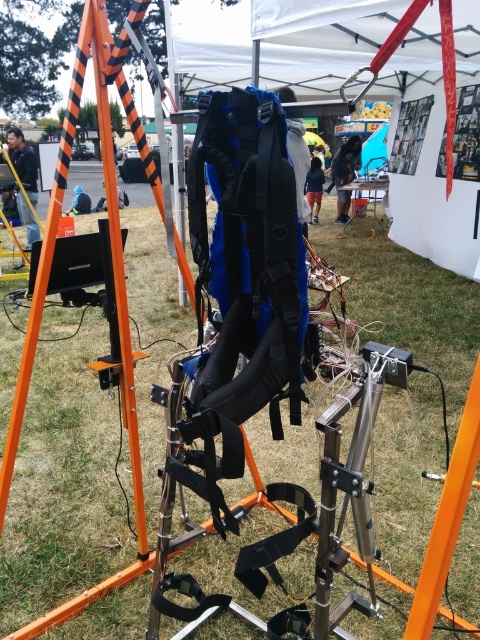
Based on the photo, you are at a tech fair and see the orange metallic ladder at center and the dark blue fabric jacket at center. Which object takes up more space in the image?

The orange metallic ladder at center is bigger than dark blue fabric jacket at center, so it takes up more space in the image.

You are standing in the middle of the outdoor area and see the green grass at center and the orange metallic ladder at center. Which object is closer to the ground?

The green grass at center is positioned under the orange metallic ladder at center, so the green grass at center is closer to the ground.

You are standing at the point marked as point (x=62, y=486) in the image. What is the color of the ground beneath your feet?

The point (x=62, y=486) corresponds to green grass at center, so the ground beneath your feet is green grass.